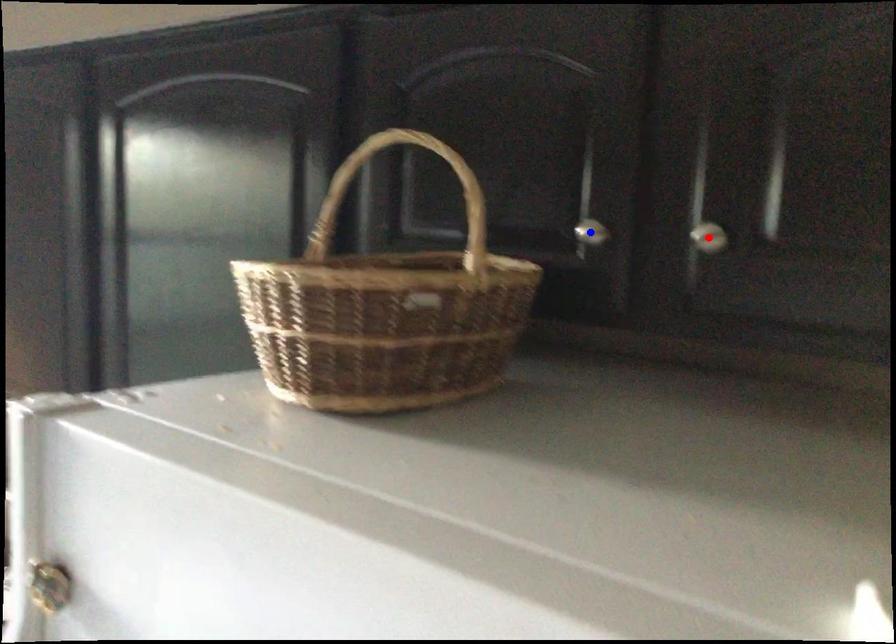
Question: Two points are marked on the image. Which point is closer to the camera?

Choices:
 (A) Blue point is closer.
 (B) Red point is closer.

Answer: (B)